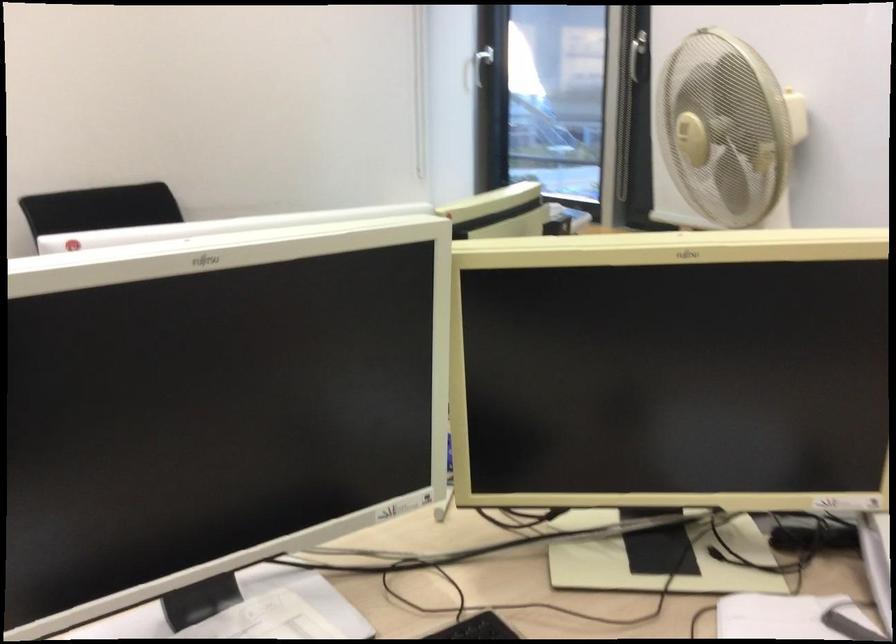
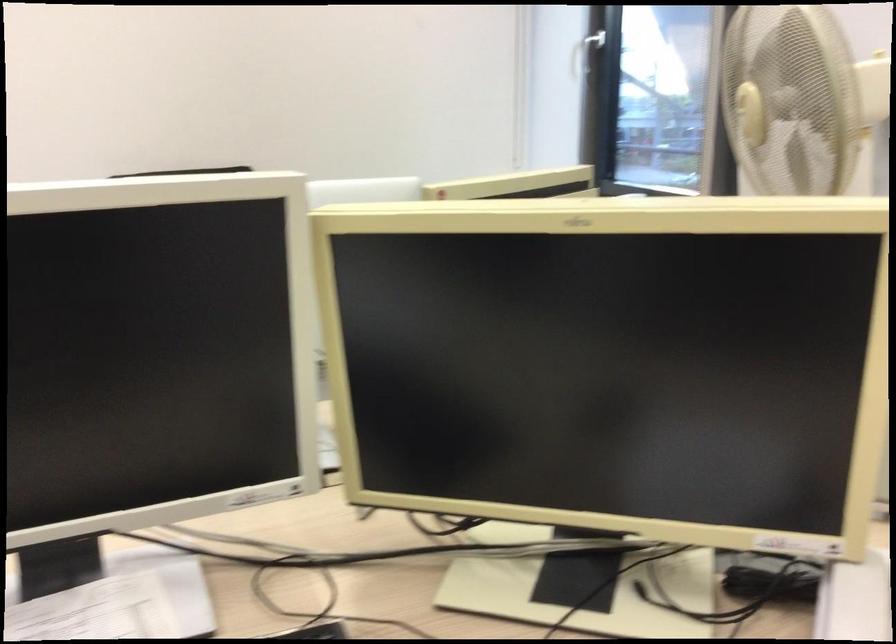
Which direction would the cameraman need to move to produce the second image?

The cameraman moved toward right, forward.